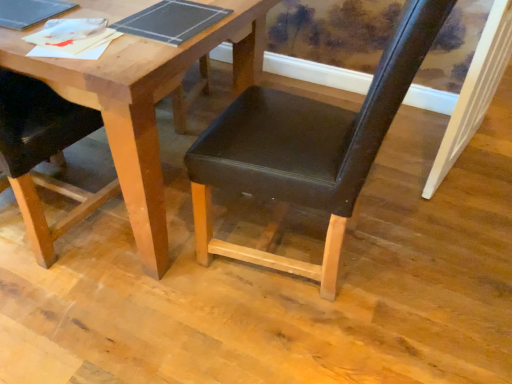
Question: From a real-world perspective, is matte black chair at left, arranged as the 1th chair when viewed from the left, physically located above or below wooden table at center?

Choices:
 (A) above
 (B) below

Answer: (A)

Question: Do you think matte black chair at left, the second chair from the right, is within wooden table at center, or outside of it?

Choices:
 (A) outside
 (B) inside

Answer: (B)

Question: Estimate the real-world distances between objects in this image. Which object is farther from the matte black chair at center, the first chair positioned from the right?

Choices:
 (A) matte black chair at left, the second chair from the right
 (B) white painted wood door frame at right
 (C) wooden table at center

Answer: (B)

Question: Estimate the real-world distances between objects in this image. Which object is farther from the matte black chair at left, arranged as the 1th chair when viewed from the left?

Choices:
 (A) matte black chair at center, the first chair positioned from the right
 (B) white painted wood door frame at right
 (C) wooden table at center

Answer: (B)